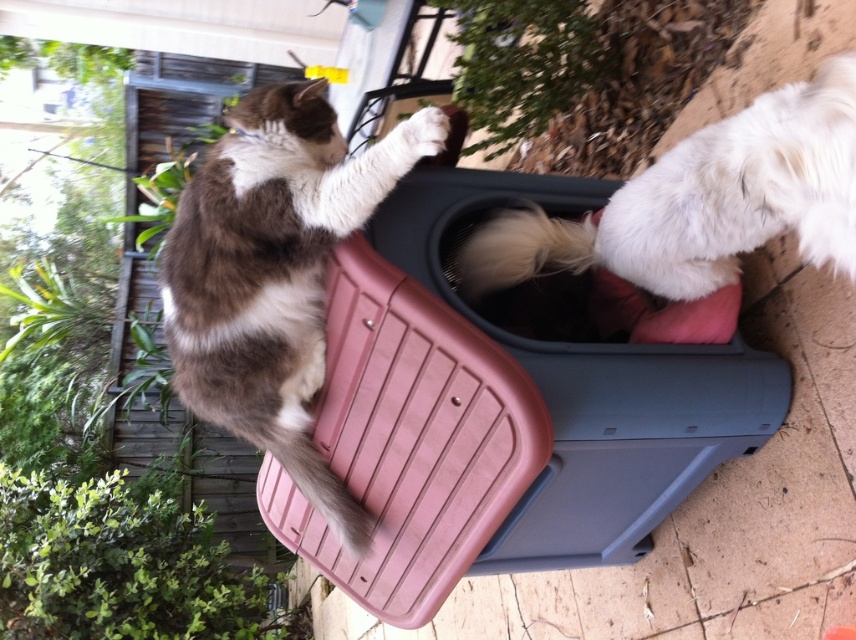
Question: Does white fluffy dog at upper right have a larger size compared to blonde fur tail at center?

Choices:
 (A) yes
 (B) no

Answer: (A)

Question: Can you confirm if white fluffy dog at upper right is positioned to the right of blonde fur tail at center?

Choices:
 (A) yes
 (B) no

Answer: (A)

Question: Which point is farther from the camera taking this photo?

Choices:
 (A) (593, 230)
 (B) (843, 166)

Answer: (A)

Question: Estimate the real-world distances between objects in this image. Which object is farther from the brown and white fur cat at upper left?

Choices:
 (A) white fluffy dog at upper right
 (B) blonde fur tail at center

Answer: (A)

Question: Which object is positioned farthest from the white fluffy dog at upper right?

Choices:
 (A) blonde fur tail at center
 (B) brown and white fur cat at upper left

Answer: (B)

Question: Is brown and white fur cat at upper left positioned in front of blonde fur tail at center?

Choices:
 (A) yes
 (B) no

Answer: (A)